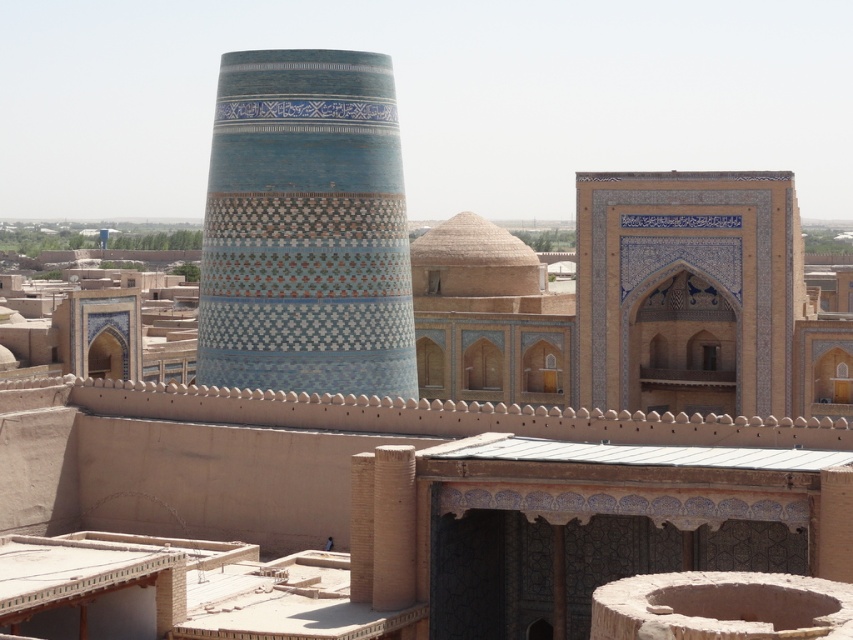
Measure the distance between point (225, 131) and camera.

Point (225, 131) is 265.23 feet from camera.

Describe the element at coordinates (305, 228) in the screenshot. I see `blue glazed tile tower at center` at that location.

Who is more forward, (374, 109) or (624, 360)?

Positioned in front is point (374, 109).

Locate an element on the screen. The height and width of the screenshot is (640, 853). blue glazed tile tower at center is located at coordinates (305, 228).